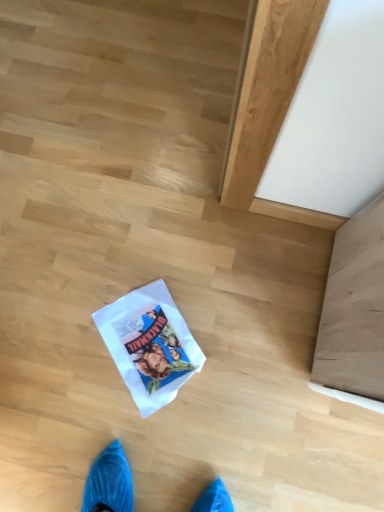
Describe the element at coordinates (149, 345) in the screenshot. I see `white paper comic book at center` at that location.

Image resolution: width=384 pixels, height=512 pixels. I want to click on white paper comic book at center, so click(149, 345).

The height and width of the screenshot is (512, 384). In order to click on white paper comic book at center in this screenshot , I will do `click(149, 345)`.